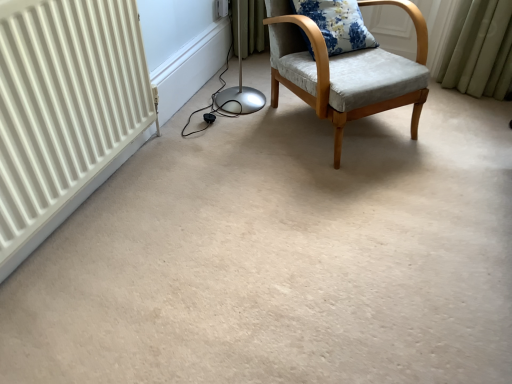
Question: From the image's perspective, relative to light gray fabric chair at center, is white plastic electric outlet at upper center above or below?

Choices:
 (A) above
 (B) below

Answer: (A)

Question: From a real-world perspective, is white plastic electric outlet at upper center physically located above or below light gray fabric chair at center?

Choices:
 (A) above
 (B) below

Answer: (B)

Question: Which object is the farthest from the light gray fabric chair at center?

Choices:
 (A) floral fabric cushion at upper right
 (B) white plastic electric outlet at upper center

Answer: (B)

Question: Which object is the farthest from the light gray fabric chair at center?

Choices:
 (A) floral fabric cushion at upper right
 (B) white plastic electric outlet at upper center

Answer: (B)